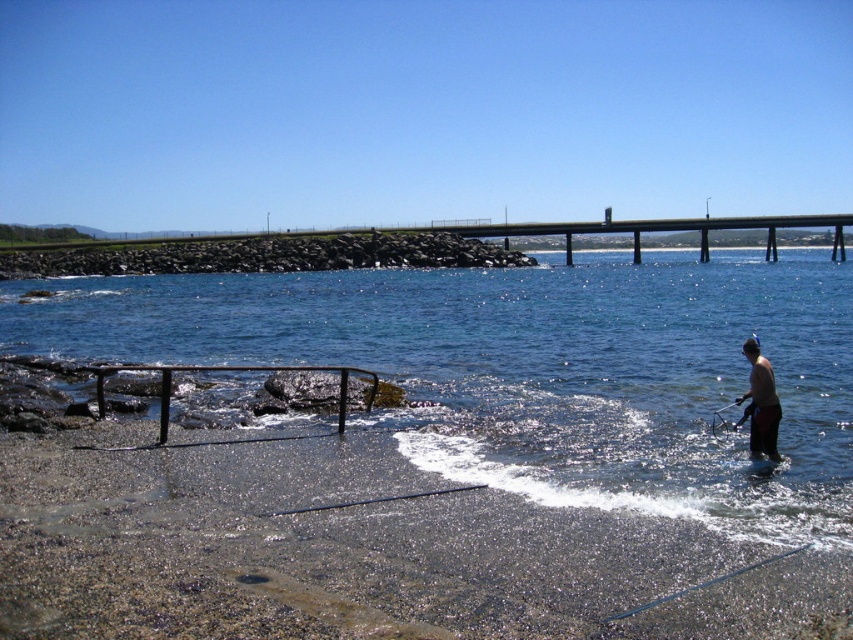
Can you confirm if clear blue water at lower center is shorter than skinny man at lower right?

In fact, clear blue water at lower center may be taller than skinny man at lower right.

Based on the photo, who is shorter, clear blue water at lower center or skinny man at lower right?

skinny man at lower right

Locate an element on the screen. The height and width of the screenshot is (640, 853). clear blue water at lower center is located at coordinates pos(532,369).